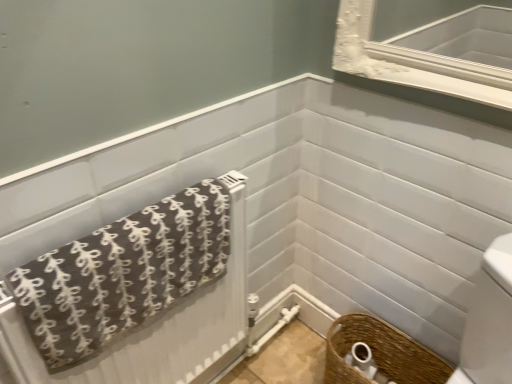
Question: Is woven brown basket at lower right next to woven brown basket at lower right and touching it?

Choices:
 (A) yes
 (B) no

Answer: (A)

Question: Does woven brown basket at lower right have a smaller size compared to woven brown basket at lower right?

Choices:
 (A) no
 (B) yes

Answer: (B)

Question: From the image's perspective, does woven brown basket at lower right appear higher than woven brown basket at lower right?

Choices:
 (A) no
 (B) yes

Answer: (B)

Question: From the image's perspective, would you say woven brown basket at lower right is shown under woven brown basket at lower right?

Choices:
 (A) no
 (B) yes

Answer: (A)

Question: Is woven brown basket at lower right facing towards woven brown basket at lower right?

Choices:
 (A) no
 (B) yes

Answer: (B)

Question: From the image's perspective, is woven brown basket at lower right positioned above or below woven brown basket at lower right?

Choices:
 (A) above
 (B) below

Answer: (B)

Question: In the image, is woven brown basket at lower right positioned in front of or behind woven brown basket at lower right?

Choices:
 (A) front
 (B) behind

Answer: (A)

Question: Is point [390, 329] positioned closer to the camera than point [356, 357]?

Choices:
 (A) farther
 (B) closer

Answer: (B)

Question: Is woven brown basket at lower right spatially inside woven brown basket at lower right, or outside of it?

Choices:
 (A) inside
 (B) outside

Answer: (B)

Question: From their relative heights in the image, would you say woven brown basket at lower right is taller or shorter than woven brown basket at lower right?

Choices:
 (A) short
 (B) tall

Answer: (A)

Question: Does point (360, 360) appear closer or farther from the camera than point (351, 329)?

Choices:
 (A) closer
 (B) farther

Answer: (A)

Question: From the image's perspective, is woven brown basket at lower right located above or below woven brown basket at lower right?

Choices:
 (A) below
 (B) above

Answer: (B)

Question: Is woven brown basket at lower right in front of or behind woven brown basket at lower right in the image?

Choices:
 (A) behind
 (B) front

Answer: (A)

Question: In the image, is woven brown basket at lower right on the left side or the right side of brown fabric towel at lower left?

Choices:
 (A) left
 (B) right

Answer: (B)

Question: Is point tap(379, 382) positioned closer to the camera than point tap(187, 215)?

Choices:
 (A) closer
 (B) farther

Answer: (B)